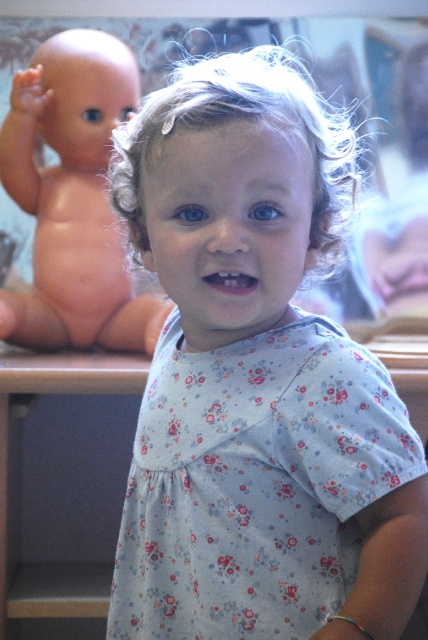
Question: Is floral cotton dress at center wider than pink matte doll at left?

Choices:
 (A) yes
 (B) no

Answer: (B)

Question: Does floral cotton dress at center have a greater width compared to pink matte doll at left?

Choices:
 (A) no
 (B) yes

Answer: (A)

Question: Which point is farther to the camera?

Choices:
 (A) (237, 577)
 (B) (157, 305)

Answer: (B)

Question: Where is floral cotton dress at center located in relation to pink matte doll at left in the image?

Choices:
 (A) above
 (B) below

Answer: (B)

Question: Which point appears farthest from the camera in this image?

Choices:
 (A) (50, 44)
 (B) (288, 518)

Answer: (A)